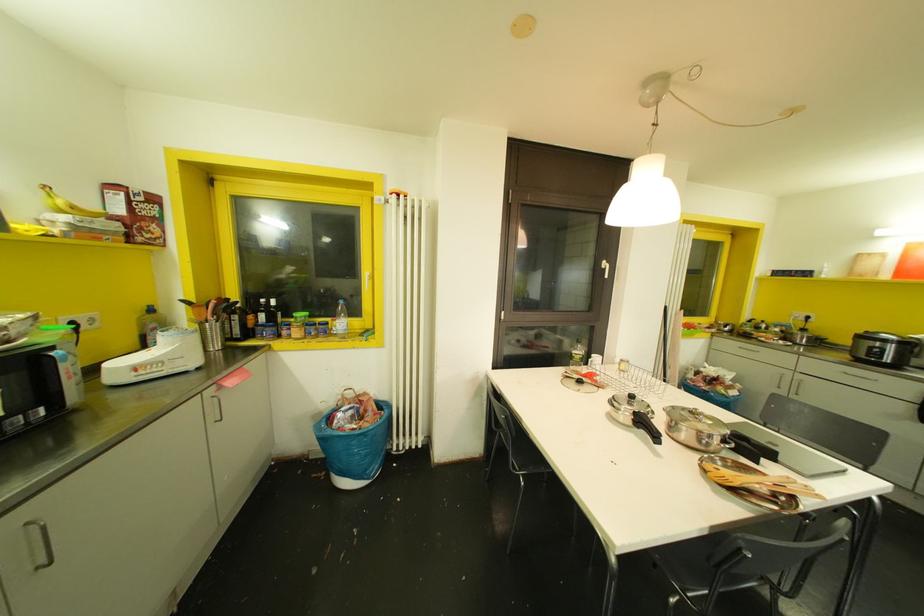
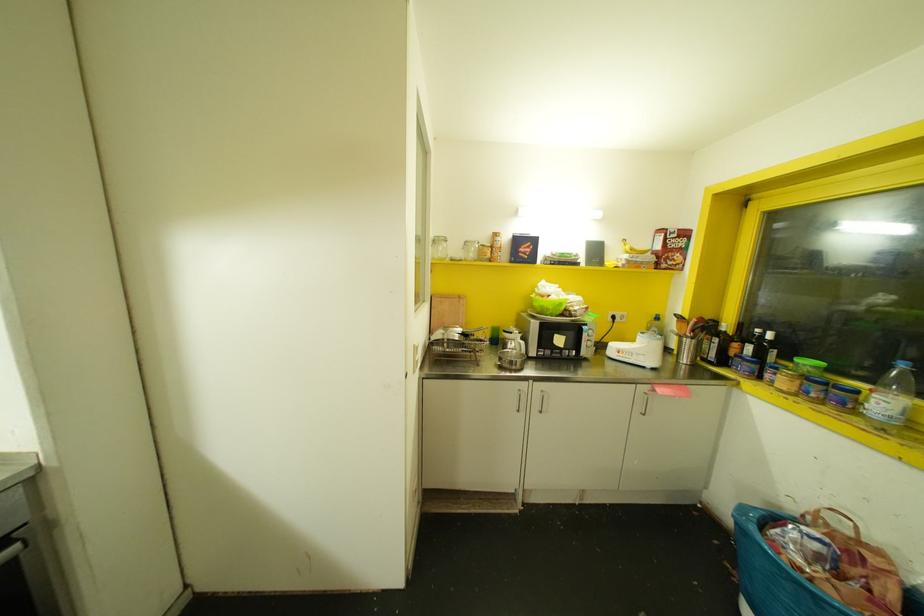
The point at (49, 562) is marked in the first image. Where is the corresponding point in the second image?

(541, 411)